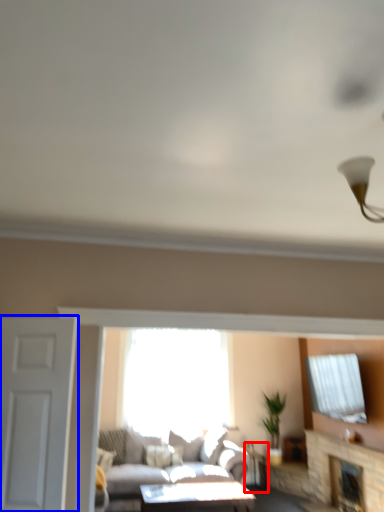
Question: Which point is further to the camera, side table (highlighted by a red box) or door (highlighted by a blue box)?

Choices:
 (A) side table
 (B) door

Answer: (A)